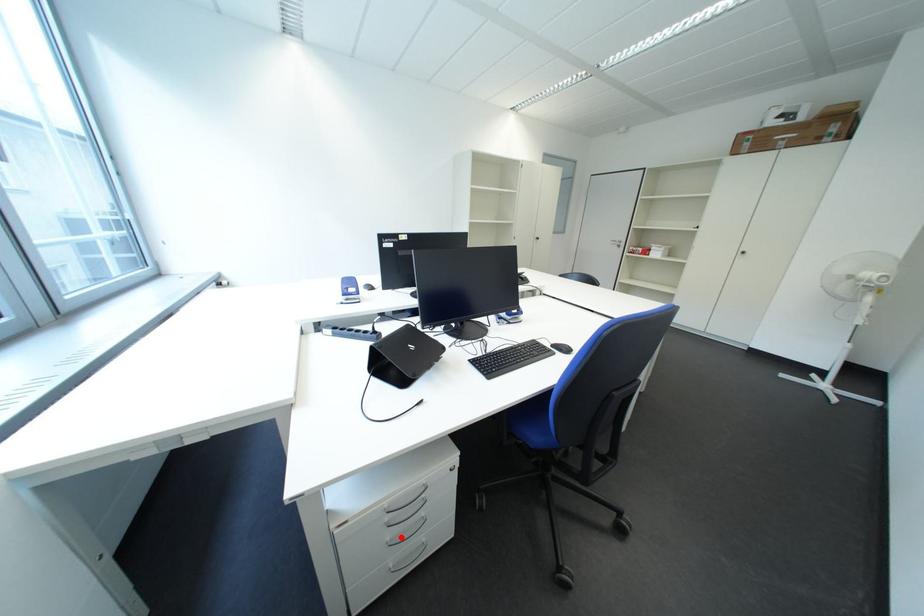
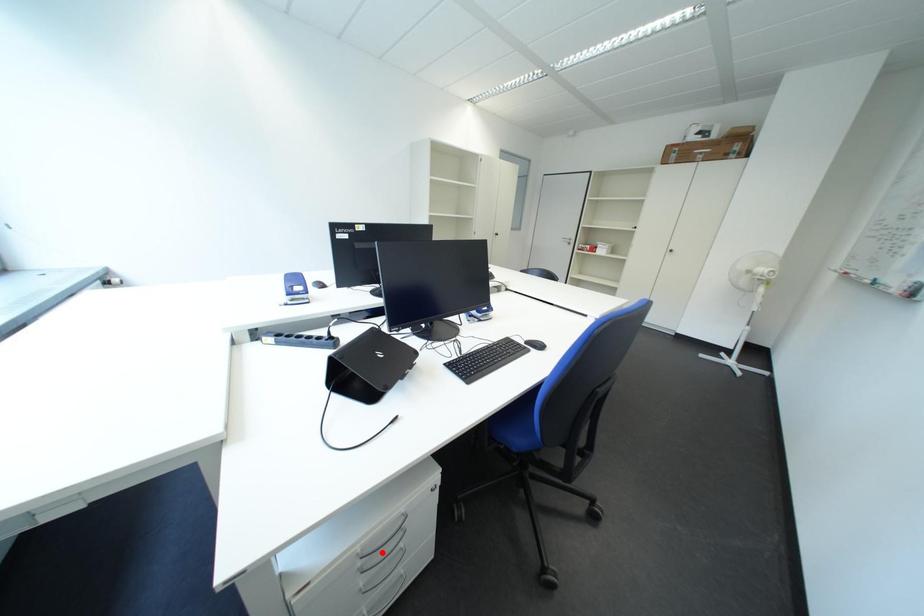
I am providing you with two images of the same scene from different viewpoints. A red point is marked on the first image and another point is marked on the second image. Is the red point in image1 aligned with the point shown in image2?

No